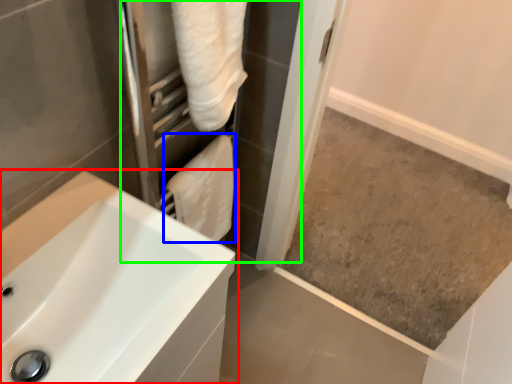
Question: Based on their relative distances, which object is nearer to sink (highlighted by a red box)? Choose from bath towel (highlighted by a blue box) and screen door (highlighted by a green box).

Choices:
 (A) bath towel
 (B) screen door

Answer: (A)